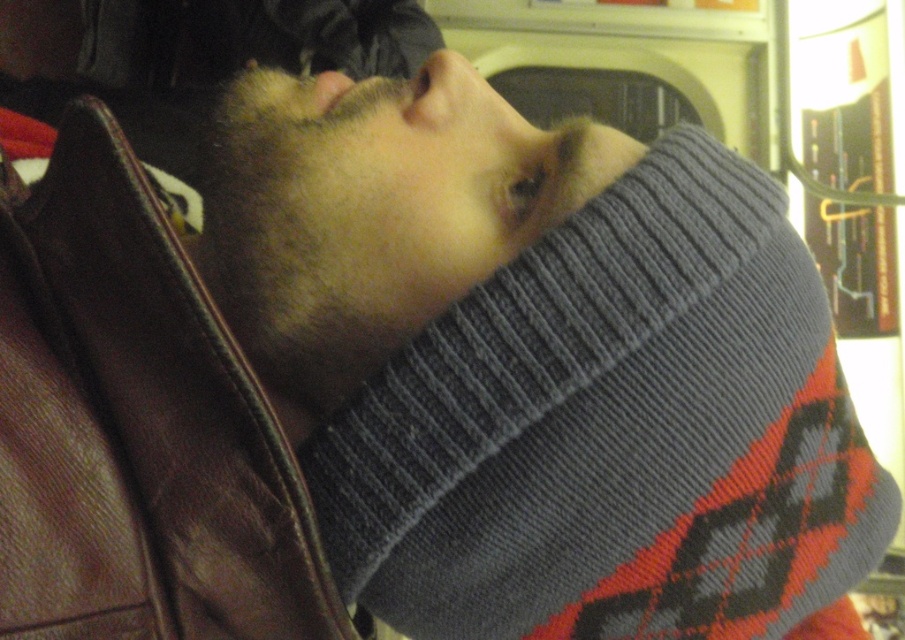
Question: Does brown leather jacket at left have a greater width compared to gray knitted sweater at center?

Choices:
 (A) no
 (B) yes

Answer: (A)

Question: Which point is closer to the camera?

Choices:
 (A) brown leather jacket at left
 (B) gray knitted sweater at center

Answer: (A)

Question: Which object is farther from the camera taking this photo?

Choices:
 (A) gray knitted sweater at center
 (B) brown leather jacket at left

Answer: (A)

Question: Does brown leather jacket at left have a lesser width compared to gray knitted sweater at center?

Choices:
 (A) no
 (B) yes

Answer: (B)

Question: Is brown leather jacket at left above gray knitted sweater at center?

Choices:
 (A) yes
 (B) no

Answer: (B)